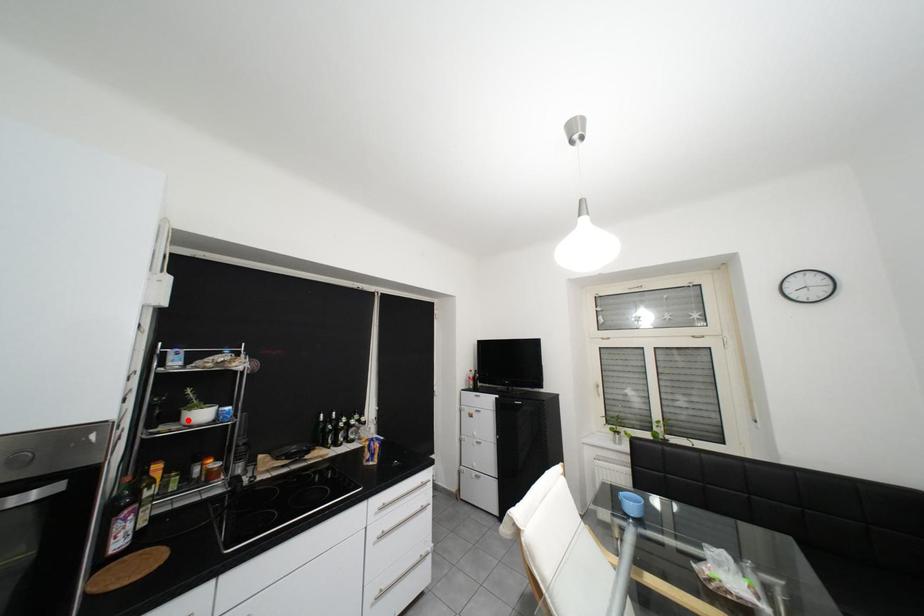
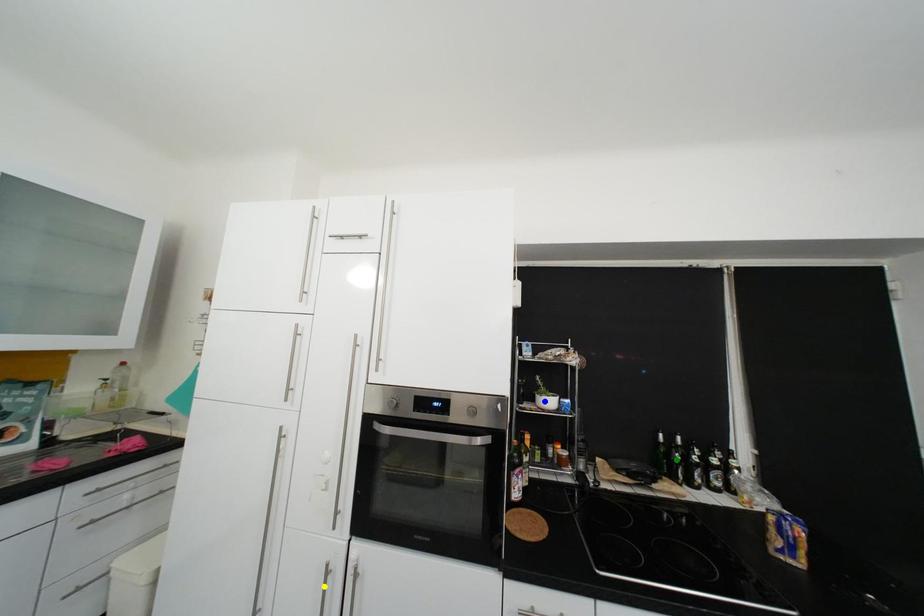
Question: I am providing you with two images of the same scene from different viewpoints. A red point is marked on the first image. You are given multiple points on the second image. Which point in image 2 is actually the same real-world point as the red point in image 1?

Choices:
 (A) yellow point
 (B) green point
 (C) blue point

Answer: (C)